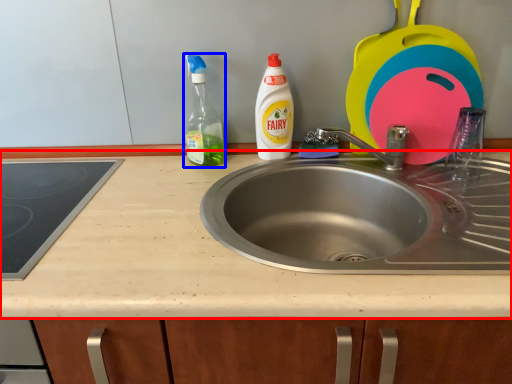
Question: Which object is closer to the camera taking this photo, countertop (highlighted by a red box) or cleaning product (highlighted by a blue box)?

Choices:
 (A) countertop
 (B) cleaning product

Answer: (A)